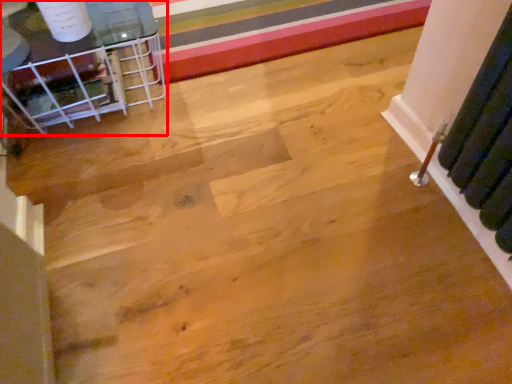
Question: Where is furniture (annotated by the red box) located in relation to stripe in the image?

Choices:
 (A) right
 (B) left

Answer: (B)